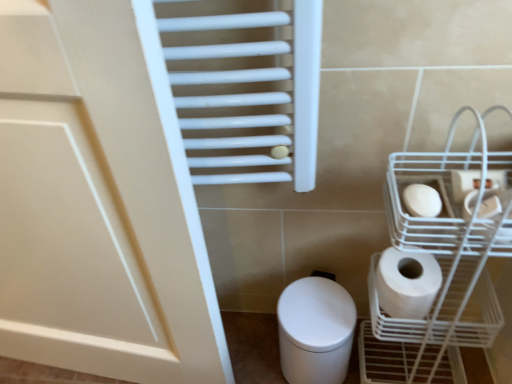
Question: Would you say white matte toilet paper at right, placed as the 3th toilet paper when sorted from bottom to top, contains white matte toilet paper at lower right, the third toilet paper when ordered from top to bottom?

Choices:
 (A) no
 (B) yes

Answer: (A)

Question: Is white matte toilet paper at right, which is the 1th toilet paper in top-to-bottom order, to the left of white matte toilet paper at lower right, the third toilet paper when ordered from top to bottom, from the viewer's perspective?

Choices:
 (A) no
 (B) yes

Answer: (A)

Question: Does white matte toilet paper at right, placed as the 3th toilet paper when sorted from bottom to top, have a larger size compared to white matte toilet paper at lower right, the first toilet paper in the bottom-to-top sequence?

Choices:
 (A) no
 (B) yes

Answer: (A)

Question: Is white matte toilet paper at right, which is the 1th toilet paper in top-to-bottom order, turned away from white matte toilet paper at lower right, the third toilet paper when ordered from top to bottom?

Choices:
 (A) no
 (B) yes

Answer: (A)

Question: From the image's perspective, does white matte toilet paper at right, which is the 1th toilet paper in top-to-bottom order, appear higher than white matte toilet paper at lower right, the third toilet paper when ordered from top to bottom?

Choices:
 (A) yes
 (B) no

Answer: (A)

Question: Is white matte toilet paper at right, which is the 2th toilet paper from bottom to top, in front of or behind white matte toilet paper at right, placed as the 3th toilet paper when sorted from bottom to top, in the image?

Choices:
 (A) behind
 (B) front

Answer: (B)

Question: From a real-world perspective, relative to white matte toilet paper at right, placed as the 3th toilet paper when sorted from bottom to top, is white matte toilet paper at right, which is the 2th toilet paper from bottom to top, vertically above or below?

Choices:
 (A) below
 (B) above

Answer: (A)

Question: In terms of size, does white matte toilet paper at right, which is the 2th toilet paper from bottom to top, appear bigger or smaller than white matte toilet paper at right, placed as the 3th toilet paper when sorted from bottom to top?

Choices:
 (A) big
 (B) small

Answer: (B)

Question: In terms of width, does white matte toilet paper at right, which is counted as the second toilet paper, starting from the top, look wider or thinner when compared to white matte toilet paper at right, which is the 1th toilet paper in top-to-bottom order?

Choices:
 (A) wide
 (B) thin

Answer: (A)

Question: From the image's perspective, is white matte toilet paper at right, which is the 1th toilet paper in top-to-bottom order, located above or below white glossy bidet at lower center?

Choices:
 (A) above
 (B) below

Answer: (A)

Question: Is point (486, 178) closer or farther from the camera than point (317, 299)?

Choices:
 (A) closer
 (B) farther

Answer: (A)

Question: Choose the correct answer: Is white matte toilet paper at right, which is the 1th toilet paper in top-to-bottom order, inside white glossy bidet at lower center or outside it?

Choices:
 (A) outside
 (B) inside

Answer: (A)

Question: From a real-world perspective, relative to white glossy bidet at lower center, is white matte toilet paper at right, placed as the 3th toilet paper when sorted from bottom to top, vertically above or below?

Choices:
 (A) above
 (B) below

Answer: (A)

Question: From their relative heights in the image, would you say white glossy bidet at lower center is taller or shorter than white matte toilet paper at right, which is the 1th toilet paper in top-to-bottom order?

Choices:
 (A) tall
 (B) short

Answer: (A)

Question: From a real-world perspective, is white glossy bidet at lower center physically located above or below white matte toilet paper at right, placed as the 3th toilet paper when sorted from bottom to top?

Choices:
 (A) above
 (B) below

Answer: (B)